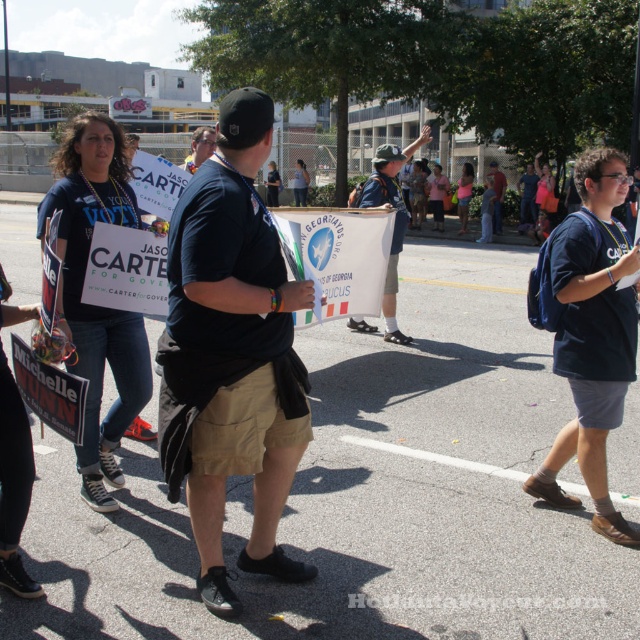
Who is more distant from viewer, [230,419] or [612,156]?

Point [612,156]

Find the location of `black cotton t-shirt at center`. black cotton t-shirt at center is located at coordinates (230, 355).

Does black cotton t-shirt at center lie behind denim shorts at center?

That is False.

Does black cotton t-shirt at center have a larger size compared to denim shorts at center?

Actually, black cotton t-shirt at center might be smaller than denim shorts at center.

Is point (240, 364) closer to camera compared to point (376, 193)?

Yes.

Locate an element on the screen. This screenshot has height=640, width=640. black cotton t-shirt at center is located at coordinates (230, 355).

How distant is blue cotton t-shirt at center from black fabric shirt at center?

They are 4.67 meters apart.

Can you confirm if blue cotton t-shirt at center is positioned to the left of black fabric shirt at center?

In fact, blue cotton t-shirt at center is to the right of black fabric shirt at center.

Who is more distant from viewer, (554, 492) or (196, 138)?

The point (196, 138) is behind.

Locate an element on the screen. The height and width of the screenshot is (640, 640). blue cotton t-shirt at center is located at coordinates (588, 332).